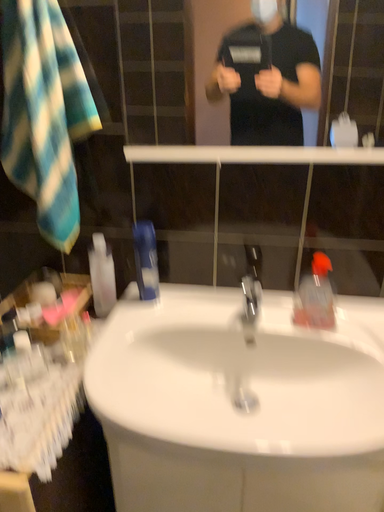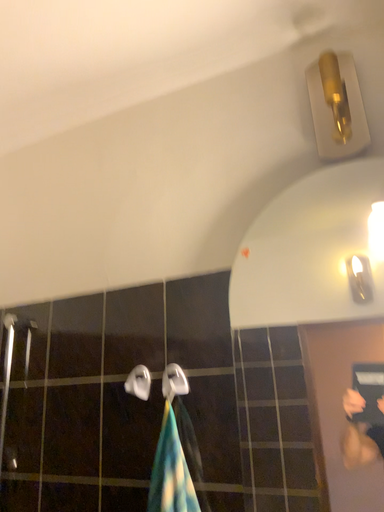
Question: How did the camera likely rotate when shooting the video?

Choices:
 (A) rotated downward
 (B) rotated upward

Answer: (B)